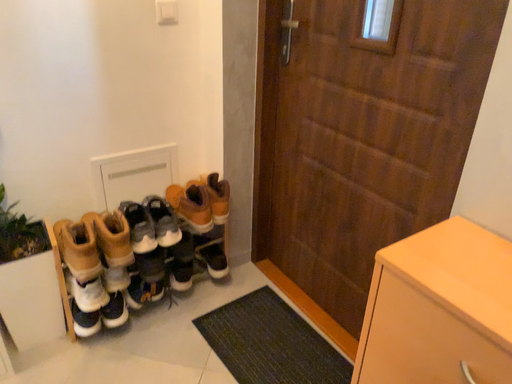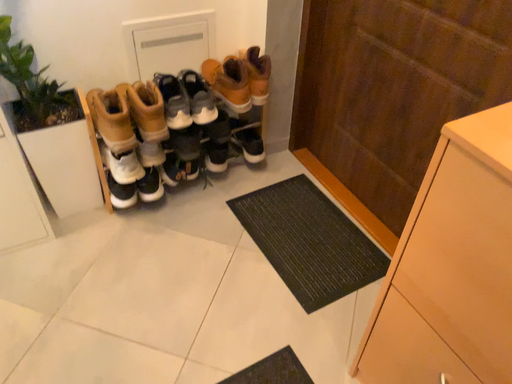
Question: Which way did the camera rotate in the video?

Choices:
 (A) rotated upward
 (B) rotated downward

Answer: (B)